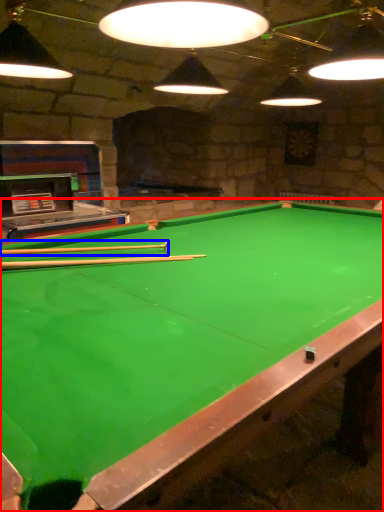
Question: Which object is closer to the camera taking this photo, billiard table (highlighted by a red box) or cue (highlighted by a blue box)?

Choices:
 (A) billiard table
 (B) cue

Answer: (A)